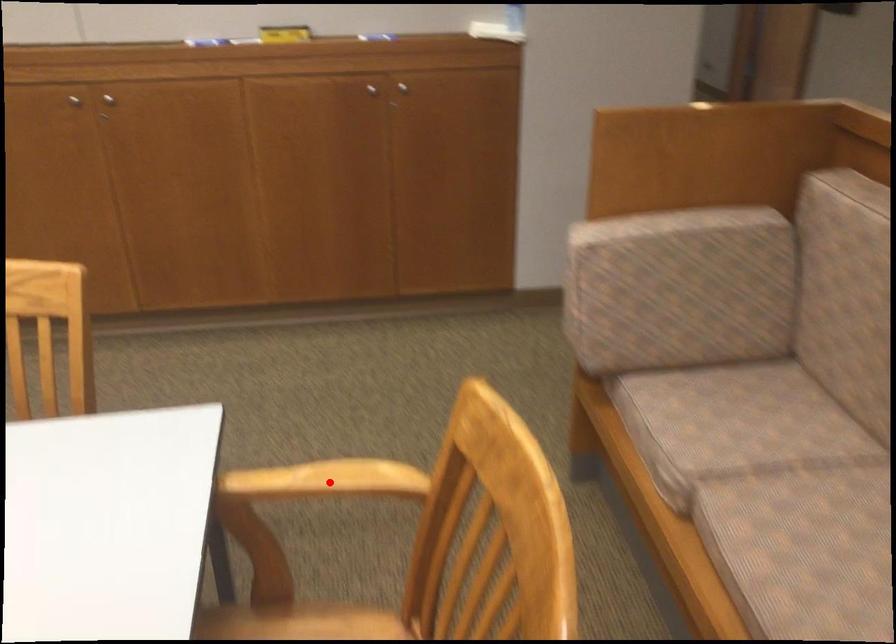
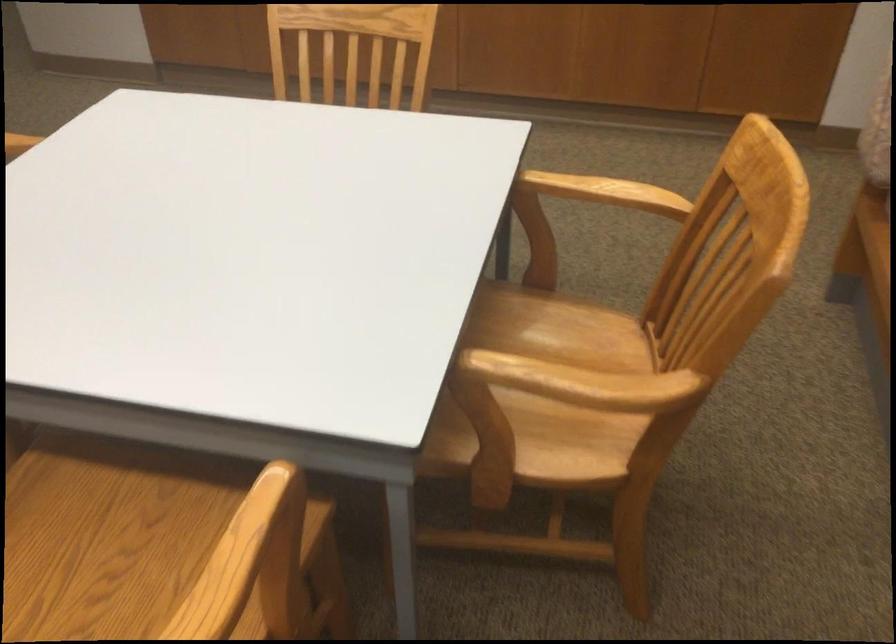
Locate, in the second image, the point that corresponds to the highlighted location in the first image.

(605, 192)